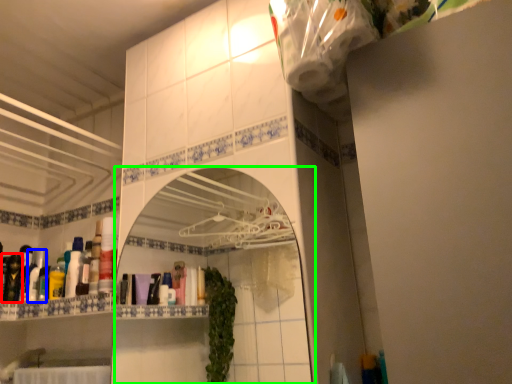
Question: Based on their relative distances, which object is nearer to toiletry (highlighted by a red box)? Choose from toiletry (highlighted by a blue box) and mirror (highlighted by a green box).

Choices:
 (A) toiletry
 (B) mirror

Answer: (A)